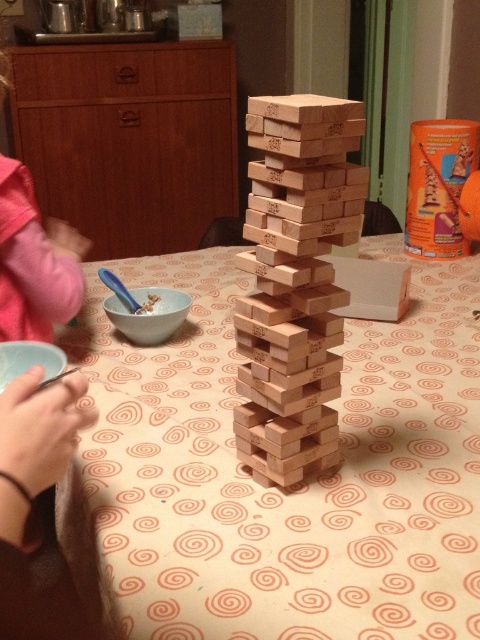
You are a small toy mouse that is 2 inches wide. You want to move from the natural wood tower at center to the pink fabric sleeve at left. Is there enough space for you to move sideways between them?

The distance between the natural wood tower at center and pink fabric sleeve at left is 16.39 inches, so yes, the toy mouse can move sideways between them since the space is wider than the mouse.

You are sitting at the dining table and want to place your phone on the wooden table at center. However, you notice the pink fabric sleeve at left might be in the way. From your perspective, which object is located to the right of the other?

The wooden table at center is positioned on the right side of pink fabric sleeve at left, so from your perspective, the wooden table at center is to the right of the pink fabric sleeve at left.

You are standing at the origin point in the image coordinate system. Where is the wooden table at center located in terms of its 2D coordinates?

The wooden table at center is located at the 2D coordinates of point (289,486).